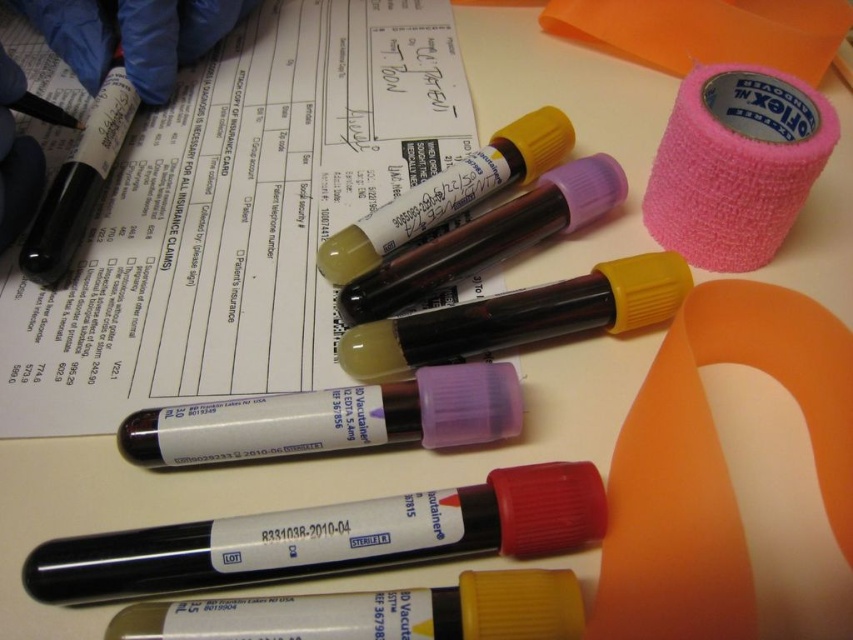
Question: Can you confirm if white paper at center is thinner than pink fabric tape at upper right?

Choices:
 (A) yes
 (B) no

Answer: (B)

Question: Which point appears farthest from the camera in this image?

Choices:
 (A) (672, 106)
 (B) (54, 541)
 (C) (61, 413)

Answer: (A)

Question: Does white paper at center appear over pink fabric tape at upper right?

Choices:
 (A) no
 (B) yes

Answer: (B)

Question: Which point is closer to the camera?

Choices:
 (A) pink fabric tape at upper right
 (B) white paper at center

Answer: (A)

Question: Does matte black pen at lower center have a smaller size compared to pink fabric tape at upper right?

Choices:
 (A) yes
 (B) no

Answer: (A)

Question: Which of the following is the farthest from the observer?

Choices:
 (A) 680,164
 (B) 392,502
 (C) 315,93

Answer: (C)